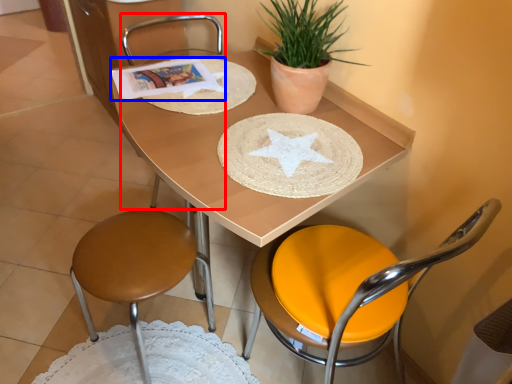
Question: Which of the following is the closest to the observer, chair (highlighted by a red box) or magazine (highlighted by a blue box)?

Choices:
 (A) chair
 (B) magazine

Answer: (B)